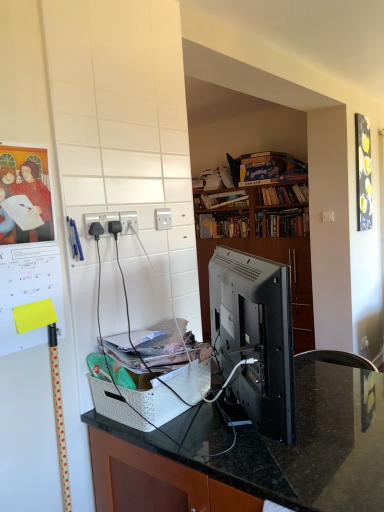
This screenshot has width=384, height=512. Describe the element at coordinates (255, 455) in the screenshot. I see `white plastic basket at center` at that location.

What is the approximate height of white plastic basket at center?

white plastic basket at center is 71.64 centimeters tall.

In the scene shown: What is the approximate height of hardcover book at upper center, the fifth book ordered from the bottom?

hardcover book at upper center, the fifth book ordered from the bottom, is 23.25 centimeters in height.

This screenshot has height=512, width=384. What do you see at coordinates (208, 180) in the screenshot?
I see `hardcover book at upper center, which is the 2th book from top to bottom` at bounding box center [208, 180].

At what (x,y) coordinates should I click in order to perform the action: click on hardcover book at center, marked as the sixth book in a top-to-bottom arrangement. Please return your answer as a coordinate pair (x, y). The image size is (384, 512). Looking at the image, I should click on (282, 223).

In order to face hardcover book at center, arranged as the 1th book when ordered from the bottom, should I rotate leftwards or rightwards?

It's best to rotate right around 11.615 degrees.

Describe the element at coordinates (27, 244) in the screenshot. I see `matte paper poster at upper left` at that location.

What is the approximate height of matte paper poster at upper left?

24.01 inches.

Find the location of `white plastic basket at center`. white plastic basket at center is located at coordinates pos(255,455).

Which of these two, hardcover book at center, marked as the sixth book in a top-to-bottom arrangement, or hardcover book at upper center, the fifth book ordered from the bottom, is smaller?

With smaller size is hardcover book at upper center, the fifth book ordered from the bottom.

Find the location of a particular element. the 4th book counting from the right of the hardcover book at upper center, which is the 2th book from top to bottom is located at coordinates (282, 223).

Which is less distant, (x=262, y=219) or (x=211, y=172)?

Positioned in front is point (x=262, y=219).

Considering the relative sizes of hardcover book at center, marked as the sixth book in a top-to-bottom arrangement, and hardcover book at upper center, which is the 2th book from top to bottom, in the image provided, is hardcover book at center, marked as the sixth book in a top-to-bottom arrangement, wider than hardcover book at upper center, which is the 2th book from top to bottom,?

Indeed, hardcover book at center, marked as the sixth book in a top-to-bottom arrangement, has a greater width compared to hardcover book at upper center, which is the 2th book from top to bottom.

Are hardcover book at center, the 5th book when ordered from top to bottom, and hardcover book at center, arranged as the 1th book when ordered from the bottom, far apart?

hardcover book at center, the 5th book when ordered from top to bottom, is near hardcover book at center, arranged as the 1th book when ordered from the bottom, not far away.

Considering the sizes of hardcover book at center, the 5th book when ordered from top to bottom, and hardcover book at center, arranged as the 1th book when ordered from the bottom, in the image, is hardcover book at center, the 5th book when ordered from top to bottom, wider or thinner than hardcover book at center, arranged as the 1th book when ordered from the bottom,?

Clearly, hardcover book at center, the 5th book when ordered from top to bottom, has less width compared to hardcover book at center, arranged as the 1th book when ordered from the bottom.

Which of these two, hardcover book at center, the 5th book when ordered from top to bottom, or hardcover book at center, arranged as the 1th book when ordered from the bottom, is smaller?

hardcover book at center, arranged as the 1th book when ordered from the bottom.

Is hardcover book at center, which appears as the 2th book when ordered from the bottom, completely or partially outside of hardcover book at center, arranged as the 1th book when ordered from the bottom?

Yes.

Relative to hardcover book at upper center, acting as the 6th book starting from the bottom, is hardcover book at upper center, acting as the fourth book starting from the bottom, in front or behind?

hardcover book at upper center, acting as the fourth book starting from the bottom, is positioned farther from the viewer than hardcover book at upper center, acting as the 6th book starting from the bottom.

From a real-world perspective, is hardcover book at upper center, acting as the fourth book starting from the bottom, physically located above or below hardcover book at upper center, acting as the 6th book starting from the bottom?

From a real-world perspective, hardcover book at upper center, acting as the fourth book starting from the bottom, is physically below hardcover book at upper center, acting as the 6th book starting from the bottom.

How many degrees apart are the facing directions of hardcover book at upper center, acting as the fourth book starting from the bottom, and hardcover book at upper center, acting as the 6th book starting from the bottom?

The facing directions of hardcover book at upper center, acting as the fourth book starting from the bottom, and hardcover book at upper center, acting as the 6th book starting from the bottom, are 1.23 degrees apart.

In terms of height, does hardcover book at upper center, placed as the third book when sorted from top to bottom, look taller or shorter compared to hardcover book at upper center, which is the first book from top to bottom?

Clearly, hardcover book at upper center, placed as the third book when sorted from top to bottom, is shorter compared to hardcover book at upper center, which is the first book from top to bottom.

Is black glossy picture frame at upper right positioned behind white plastic electrical outlet at center, which is the second electric outlet from back to front?

Yes.

From the image's perspective, which one is positioned higher, black glossy picture frame at upper right or white plastic electrical outlet at center, which is counted as the second electric outlet, starting from the right?

From the image's view, black glossy picture frame at upper right is above.

Considering the relative sizes of black glossy picture frame at upper right and white plastic electrical outlet at center, marked as the 2th electric outlet in a front-to-back arrangement, in the image provided, is black glossy picture frame at upper right bigger than white plastic electrical outlet at center, marked as the 2th electric outlet in a front-to-back arrangement,?

Yes, black glossy picture frame at upper right is bigger than white plastic electrical outlet at center, marked as the 2th electric outlet in a front-to-back arrangement.

Are black glossy picture frame at upper right and white plastic electrical outlet at center, which is counted as the second electric outlet, starting from the right, beside each other?

black glossy picture frame at upper right and white plastic electrical outlet at center, which is counted as the second electric outlet, starting from the right, are clearly separated.

Is white plastic electrical outlet at center, marked as the 2th electric outlet in a front-to-back arrangement, positioned behind black plastic power outlet at center, the first electric outlet positioned from the front?

Yes, white plastic electrical outlet at center, marked as the 2th electric outlet in a front-to-back arrangement, is further from the viewer.

Does white plastic electrical outlet at center, which is counted as the second electric outlet, starting from the right, touch black plastic power outlet at center, the first electric outlet positioned from the front?

Result: Yes, white plastic electrical outlet at center, which is counted as the second electric outlet, starting from the right, is beside black plastic power outlet at center, the first electric outlet positioned from the front.

From their relative heights in the image, would you say white plastic electrical outlet at center, which is counted as the second electric outlet, starting from the right, is taller or shorter than black plastic power outlet at center, which ranks as the third electric outlet in right-to-left order?

white plastic electrical outlet at center, which is counted as the second electric outlet, starting from the right, is taller than black plastic power outlet at center, which ranks as the third electric outlet in right-to-left order.

Which is more to the left, white plastic electrical outlet at center, marked as the 2th electric outlet in a front-to-back arrangement, or black plastic power outlet at center, the first electric outlet when ordered from left to right?

From the viewer's perspective, black plastic power outlet at center, the first electric outlet when ordered from left to right, appears more on the left side.

Considering the sizes of white plastic electric outlet at upper center, the first electric outlet when ordered from right to left, and hardcover book at center, which appears as the 2th book when ordered from the bottom, in the image, is white plastic electric outlet at upper center, the first electric outlet when ordered from right to left, wider or thinner than hardcover book at center, which appears as the 2th book when ordered from the bottom,?

white plastic electric outlet at upper center, the first electric outlet when ordered from right to left, is thinner than hardcover book at center, which appears as the 2th book when ordered from the bottom.

Who is shorter, white plastic electric outlet at upper center, the first electric outlet when ordered from right to left, or hardcover book at center, the 5th book when ordered from top to bottom?

white plastic electric outlet at upper center, the first electric outlet when ordered from right to left.

Consider the image. From a real-world perspective, is white plastic electric outlet at upper center, positioned as the third electric outlet in front-to-back order, physically located above or below hardcover book at center, the 5th book when ordered from top to bottom?

In terms of real-world spatial position, white plastic electric outlet at upper center, positioned as the third electric outlet in front-to-back order, is above hardcover book at center, the 5th book when ordered from top to bottom.

Looking at this image, would you say hardcover book at center, the 5th book when ordered from top to bottom, is part of white plastic electric outlet at upper center, the 3th electric outlet when ordered from left to right,'s contents?

No, hardcover book at center, the 5th book when ordered from top to bottom, is not a part of white plastic electric outlet at upper center, the 3th electric outlet when ordered from left to right.

Is matte paper poster at upper left inside or outside of satin black monitor at center?

matte paper poster at upper left exists outside the volume of satin black monitor at center.

Is matte paper poster at upper left oriented towards satin black monitor at center?

No, matte paper poster at upper left is not turned towards satin black monitor at center.

Considering the sizes of matte paper poster at upper left and satin black monitor at center in the image, is matte paper poster at upper left bigger or smaller than satin black monitor at center?

In the image, matte paper poster at upper left appears to be smaller than satin black monitor at center.

Is matte paper poster at upper left positioned in front of satin black monitor at center?

No, it is not.

From a real-world perspective, count 4th books downward from the hardcover book at upper center, which is the 2th book from top to bottom, and point to it. Please provide its 2D coordinates.

[(282, 223)]

From the hardcover book at center, arranged as the 1th book when ordered from the bottom, count the 2nd book to the left and point to it. Please provide its 2D coordinates.

[(222, 225)]

Based on their spatial positions, is hardcover book at upper center, placed as the third book when sorted from top to bottom, or white plastic basket at center closer to satin black monitor at center?

Based on the image, white plastic basket at center appears to be nearer to satin black monitor at center.

Looking at this image, which object lies nearer to the anchor point white plastic electric outlet at upper center, the first electric outlet when ordered from right to left, matte paper poster at upper left or hardcover book at center, which appears as the 2th book when ordered from the bottom?

matte paper poster at upper left.

Based on their spatial positions, is black glossy picture frame at upper right or matte paper poster at upper left further from hardcover book at upper center, the third book from the bottom?

Based on the image, matte paper poster at upper left appears to be further to hardcover book at upper center, the third book from the bottom.

Looking at the image, which one is located closer to hardcover book at center, arranged as the 1th book when ordered from the bottom, white plastic electrical outlet at center, marked as the second electric outlet in a left-to-right arrangement, or black glossy picture frame at upper right?

black glossy picture frame at upper right.

Considering their positions, is hardcover book at center, arranged as the 1th book when ordered from the bottom, positioned closer to black glossy picture frame at upper right than white plastic electrical outlet at center, which is the second electric outlet from back to front?

Among the two, hardcover book at center, arranged as the 1th book when ordered from the bottom, is located nearer to black glossy picture frame at upper right.

Looking at the image, which one is located further to matte paper poster at upper left, hardcover book at upper center, the fifth book ordered from the bottom, or white plastic electrical outlet at center, marked as the second electric outlet in a left-to-right arrangement?

hardcover book at upper center, the fifth book ordered from the bottom, is further to matte paper poster at upper left.

When comparing their distances from hardcover book at upper center, which is the first book from top to bottom, does white plastic electric outlet at upper center, the first electric outlet when ordered from right to left, or hardcover book at upper center, marked as the fourth book in a top-to-bottom arrangement, seem closer?

The object closer to hardcover book at upper center, which is the first book from top to bottom, is hardcover book at upper center, marked as the fourth book in a top-to-bottom arrangement.

Considering their positions, is hardcover book at upper center, acting as the 6th book starting from the bottom, positioned further to hardcover book at center, arranged as the 1th book when ordered from the bottom, than matte paper poster at upper left?

matte paper poster at upper left is further to hardcover book at center, arranged as the 1th book when ordered from the bottom.

Identify the location of picture frame between black plastic power outlet at center, the first electric outlet positioned from the front, and hardcover book at upper center, placed as the third book when sorted from top to bottom, along the z-axis. (363, 173).

Identify the location of desktop computer between white plastic basket at center and hardcover book at center, which appears as the 2th book when ordered from the bottom, along the z-axis. (255, 336).

Locate an element on the screen. The width and height of the screenshot is (384, 512). picture frame between matte paper poster at upper left and hardcover book at upper center, the fifth book ordered from the bottom, along the z-axis is located at coordinates (363, 173).

Find the location of `desktop computer between white plastic basket at center and hardcover book at upper center, which is the first book from top to bottom, in the front-back direction`. desktop computer between white plastic basket at center and hardcover book at upper center, which is the first book from top to bottom, in the front-back direction is located at coordinates (255, 336).